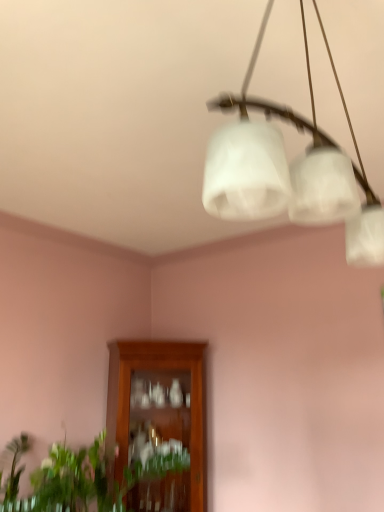
Measure the distance between point (x=46, y=511) and camera.

Point (x=46, y=511) and camera are 5.94 feet apart.

You are a GUI agent. You are given a task and a screenshot of the screen. Output one action in this format:
    pyautogui.click(x=<x>, y=<y>)
    Task: Click on the wooden cabinet at center
    Image resolution: width=384 pixels, height=512 pixels.
    Given the screenshot: What is the action you would take?
    pyautogui.click(x=160, y=417)

Find the location of a particular element. The width and height of the screenshot is (384, 512). white frosted glass chandelier at upper center is located at coordinates (321, 168).

Identify the location of green leafy plant at lower left. [91, 477].

How far apart are white frosted glass chandelier at upper center and wooden cabinet at center?

The distance of white frosted glass chandelier at upper center from wooden cabinet at center is 2.43 meters.

Between white frosted glass chandelier at upper center and wooden cabinet at center, which one appears on the right side from the viewer's perspective?

From the viewer's perspective, white frosted glass chandelier at upper center appears more on the right side.

In the scene shown: Is white frosted glass chandelier at upper center inside the boundaries of wooden cabinet at center, or outside?

white frosted glass chandelier at upper center is located beyond the bounds of wooden cabinet at center.

Considering the relative positions of green leafy plant at lower left and white frosted glass chandelier at upper center in the image provided, is green leafy plant at lower left to the right of white frosted glass chandelier at upper center from the viewer's perspective?

In fact, green leafy plant at lower left is to the left of white frosted glass chandelier at upper center.

Who is bigger, green leafy plant at lower left or white frosted glass chandelier at upper center?

green leafy plant at lower left.

What's the angular difference between green leafy plant at lower left and white frosted glass chandelier at upper center's facing directions?

5.02 degrees.

Is white frosted glass chandelier at upper center inside green leafy plant at lower left?

Actually, white frosted glass chandelier at upper center is outside green leafy plant at lower left.

Would you consider wooden cabinet at center to be distant from white frosted glass chandelier at upper center?

Yes, wooden cabinet at center and white frosted glass chandelier at upper center are located far from each other.

From a real-world perspective, who is located lower, wooden cabinet at center or white frosted glass chandelier at upper center?

In real-world perspective, wooden cabinet at center is lower.

Which of these two, wooden cabinet at center or white frosted glass chandelier at upper center, is wider?

wooden cabinet at center.

From the image's perspective, is green leafy plant at lower left beneath wooden cabinet at center?

No, from the image's perspective, green leafy plant at lower left is not beneath wooden cabinet at center.

Which is in front, green leafy plant at lower left or wooden cabinet at center?

Positioned in front is green leafy plant at lower left.

Is green leafy plant at lower left touching wooden cabinet at center?

No.

From a real-world perspective, is green leafy plant at lower left physically above wooden cabinet at center?

Incorrect, from a real-world perspective, green leafy plant at lower left is lower than wooden cabinet at center.

Considering the points (321, 216) and (59, 457), which point is behind, point (321, 216) or point (59, 457)?

Point (59, 457)

Consider the image. Which of these two, white frosted glass chandelier at upper center or green leafy plant at lower left, is bigger?

green leafy plant at lower left is bigger.

Which is behind, white frosted glass chandelier at upper center or green leafy plant at lower left?

green leafy plant at lower left.

Does wooden cabinet at center appear on the right side of green leafy plant at lower left?

Yes.

Where is `cabinetry on the right of green leafy plant at lower left`? The height and width of the screenshot is (512, 384). cabinetry on the right of green leafy plant at lower left is located at coordinates (160, 417).

Which object is further away from the camera, wooden cabinet at center or green leafy plant at lower left?

wooden cabinet at center is more distant.

Identify the location of cabinetry below the white frosted glass chandelier at upper center (from a real-world perspective). Image resolution: width=384 pixels, height=512 pixels. (160, 417).

Find the location of a particular element. houseplant lying on the left of white frosted glass chandelier at upper center is located at coordinates (91, 477).

Considering their positions, is wooden cabinet at center positioned closer to green leafy plant at lower left than white frosted glass chandelier at upper center?

Among the two, wooden cabinet at center is located nearer to green leafy plant at lower left.

When comparing their distances from wooden cabinet at center, does green leafy plant at lower left or white frosted glass chandelier at upper center seem further?

white frosted glass chandelier at upper center lies further to wooden cabinet at center than the other object.

Based on their spatial positions, is wooden cabinet at center or green leafy plant at lower left closer to white frosted glass chandelier at upper center?

Based on the image, green leafy plant at lower left appears to be nearer to white frosted glass chandelier at upper center.

When comparing their distances from green leafy plant at lower left, does white frosted glass chandelier at upper center or wooden cabinet at center seem further?

The object further to green leafy plant at lower left is white frosted glass chandelier at upper center.

From the image, which object appears to be nearer to wooden cabinet at center, white frosted glass chandelier at upper center or green leafy plant at lower left?

The object closer to wooden cabinet at center is green leafy plant at lower left.

From the image, which object appears to be farther from white frosted glass chandelier at upper center, green leafy plant at lower left or wooden cabinet at center?

The object further to white frosted glass chandelier at upper center is wooden cabinet at center.

Locate an element on the screen. The height and width of the screenshot is (512, 384). houseplant positioned between white frosted glass chandelier at upper center and wooden cabinet at center from near to far is located at coordinates (91, 477).